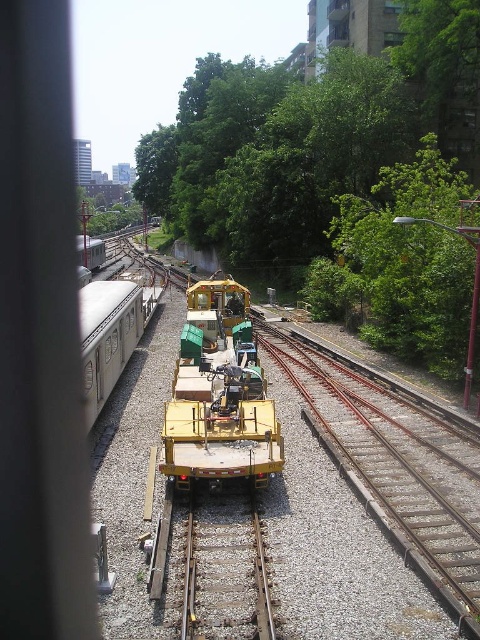
Between point (277, 461) and point (192, 604), which one is positioned behind?

The point (277, 461) is behind.

Does point (212, 380) come farther from viewer compared to point (260, 563)?

Yes, point (212, 380) is farther from viewer.

Locate an element on the screen. yellow matte train car at center is located at coordinates click(x=218, y=394).

Can you confirm if green leafy tree at right is positioned above smooth metal train track at center?

Yes, green leafy tree at right is above smooth metal train track at center.

Can you confirm if green leafy tree at right is positioned to the right of smooth metal train track at center?

Indeed, green leafy tree at right is positioned on the right side of smooth metal train track at center.

Is point (444, 168) in front of point (265, 624)?

No.

The height and width of the screenshot is (640, 480). I want to click on green leafy tree at right, so click(x=402, y=264).

Is brown metal train track at center positioned behind yellow matte train car at center?

No, it is not.

Can you confirm if brown metal train track at center is positioned below yellow matte train car at center?

Correct, brown metal train track at center is located below yellow matte train car at center.

Is point (290, 371) more distant than point (250, 394)?

Yes, point (290, 371) is behind point (250, 394).

This screenshot has width=480, height=640. What are the coordinates of `brown metal train track at center` in the screenshot? It's located at (387, 480).